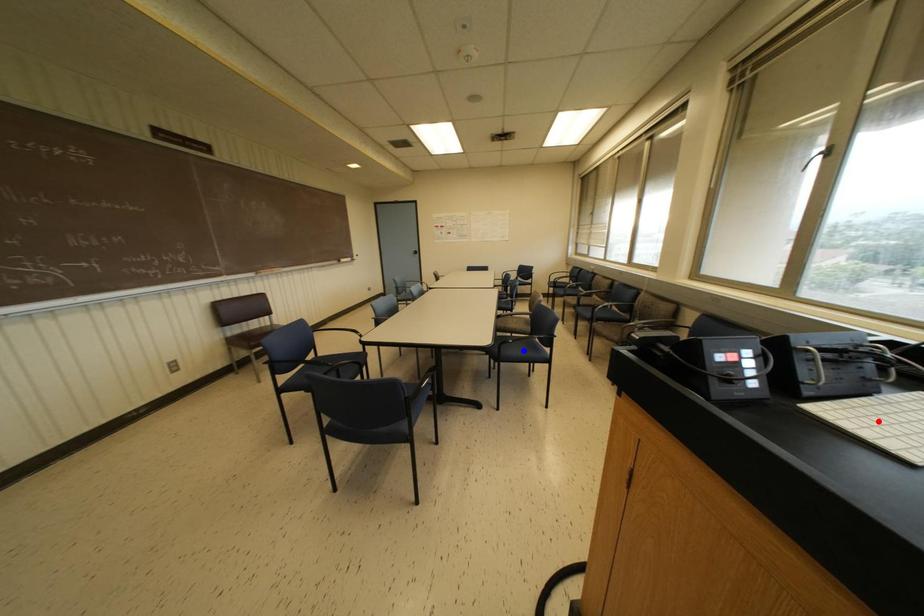
Question: In the image, two points are highlighted. Which point is nearer to the camera? Reply with the corresponding letter.

Choices:
 (A) blue point
 (B) red point

Answer: (B)